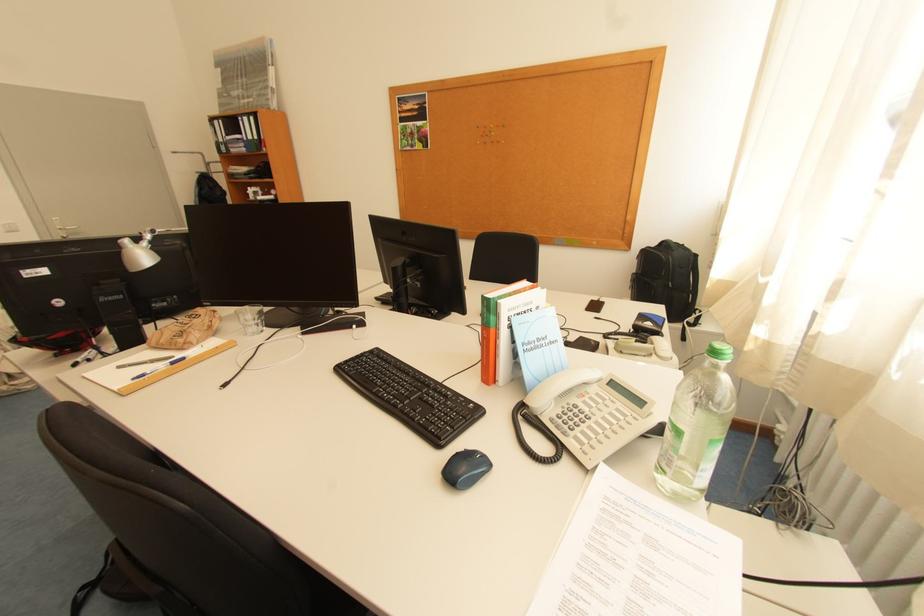
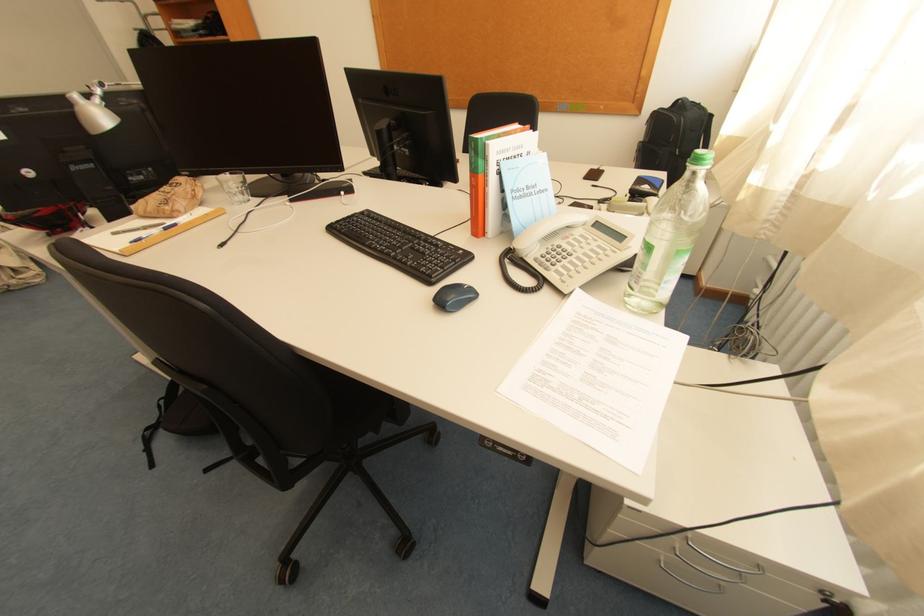
In the second image, find the point that corresponds to the point at 191,360 in the first image.

(184, 225)